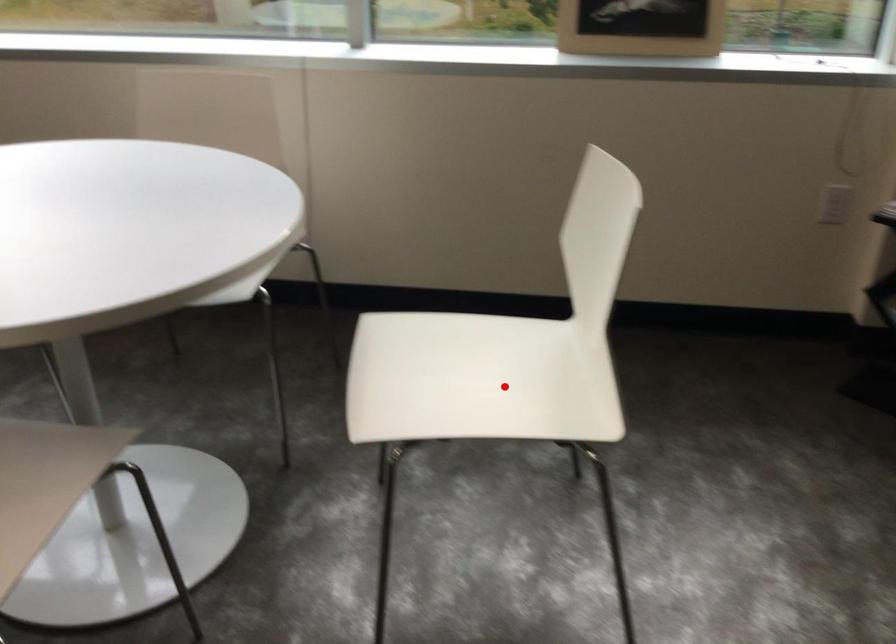
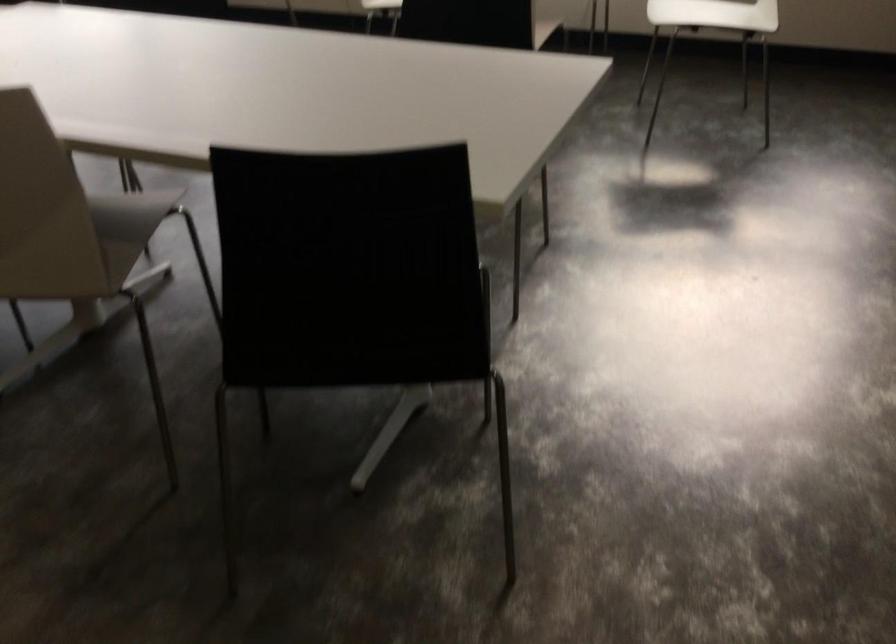
Question: I am providing you with two images of the same scene from different viewpoints. A red point is shown in image1. For the corresponding object point in image2, is it positioned nearer or farther from the camera?

Choices:
 (A) Nearer
 (B) Farther

Answer: (B)